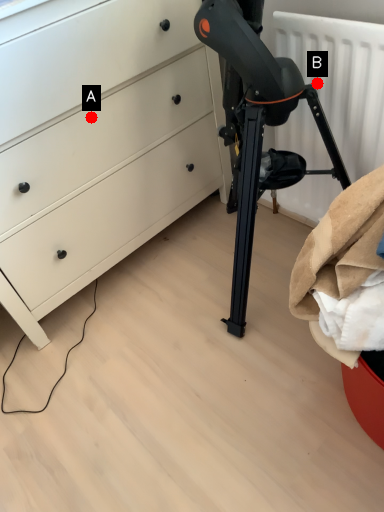
Question: Two points are circled on the image, labeled by A and B beside each circle. Which point is closer to the camera taking this photo?

Choices:
 (A) A is closer
 (B) B is closer

Answer: (B)